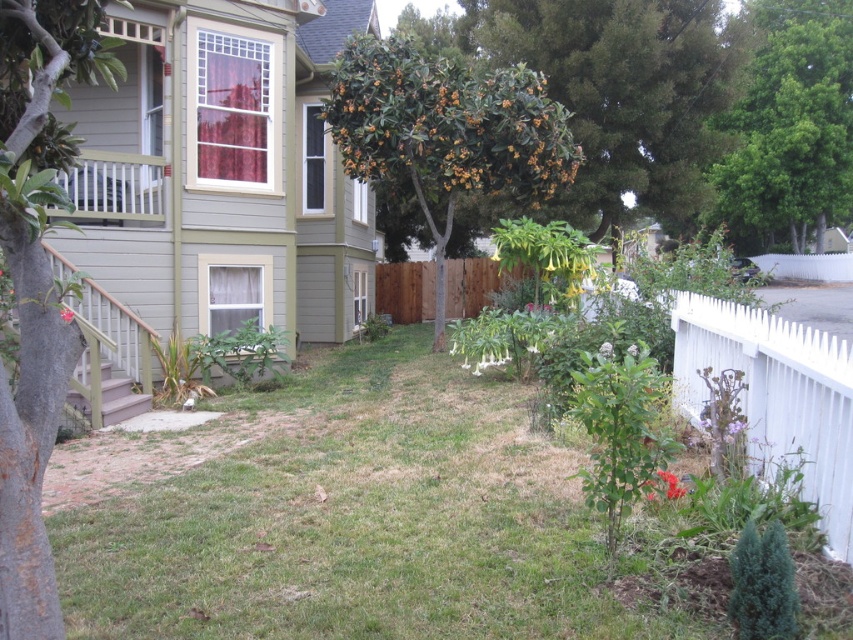
Question: From the image, what is the correct spatial relationship of green textured tree at left in relation to green leafy tree at upper right?

Choices:
 (A) below
 (B) above

Answer: (A)

Question: Considering the real-world distances, which object is closest to the green leafy tree at upper right?

Choices:
 (A) green textured tree at left
 (B) bright red flower at lower right
 (C) white fuzzy flower at center
 (D) white picket fence at right

Answer: (C)

Question: Which of the following is the closest to the observer?

Choices:
 (A) green leafy tree at upper center
 (B) bright red flower at lower right

Answer: (B)

Question: Is green leafy tree at upper right to the right of bright red flower at lower right from the viewer's perspective?

Choices:
 (A) no
 (B) yes

Answer: (B)

Question: From the image, what is the correct spatial relationship of white picket fence at right in relation to bright red flower at lower right?

Choices:
 (A) below
 (B) above

Answer: (B)

Question: Which object is closer to the camera taking this photo?

Choices:
 (A) green textured tree at left
 (B) bright red flower at lower right
 (C) red matte flower at center

Answer: (A)